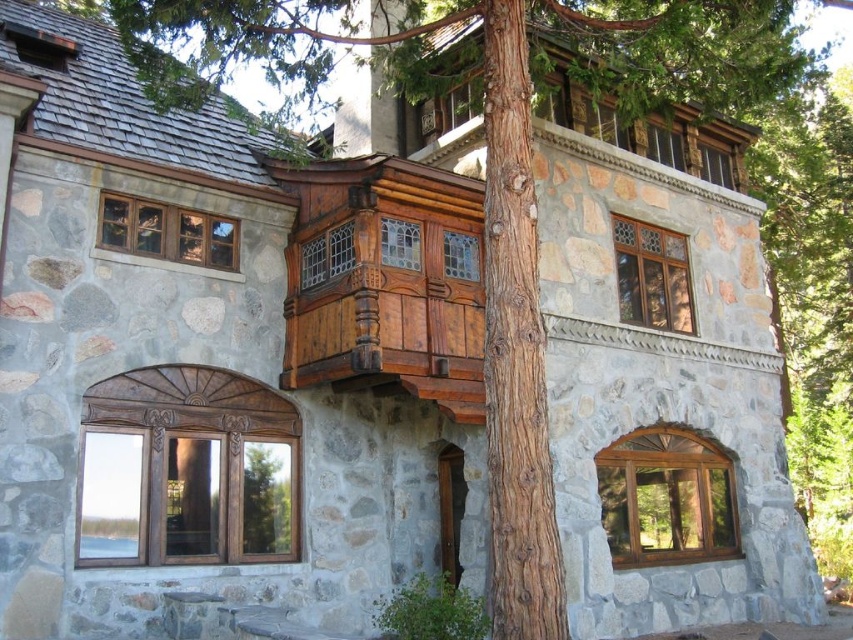
You are standing in front of the rustic stone house and want to place a small potted plant exactly at the center of the brown rough bark at center. What coordinates should you aim for?

The coordinates for the brown rough bark at center are at point (515, 349), so you should aim for those coordinates to place the potted plant exactly at the center.

You are standing in front of the rustic stone house and notice both the brown rough bark at center and the wooden balcony at upper center. Which object is closer to you?

The brown rough bark at center is closer to you as it is positioned in front of the wooden balcony at upper center.